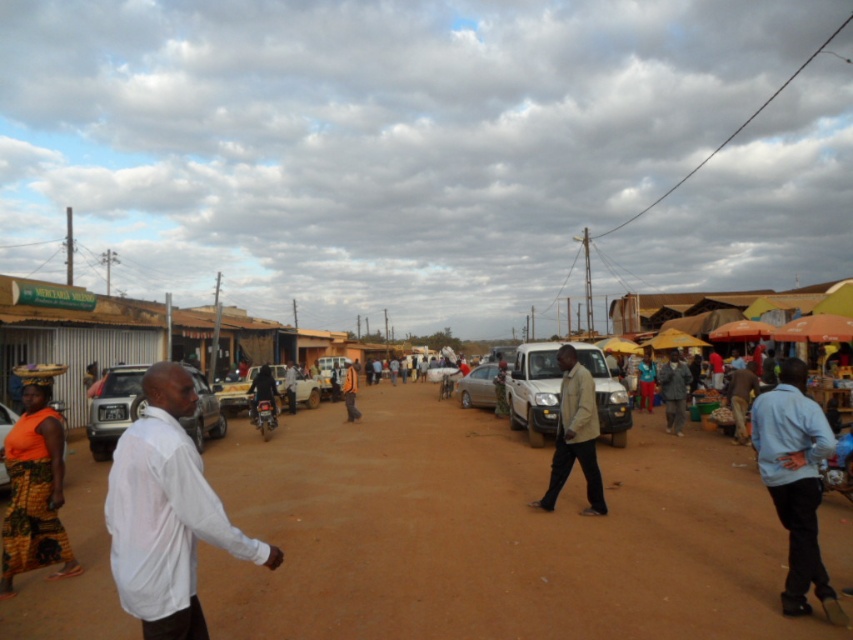
You are a delivery person who needs to park a truck that is 6 meters long. You see the matte white car at center and the satin silver car at center. Is there enough space between them to park your truck?

The distance between the matte white car at center and the satin silver car at center is 7.09 meters. Since the truck is 6 meters long, there is sufficient space to park between them.